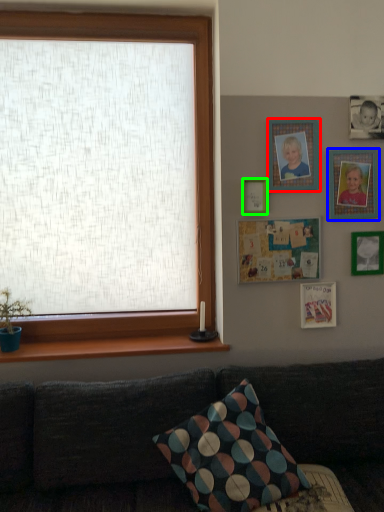
Question: Based on their relative distances, which object is farther from picture frame (highlighted by a red box)? Choose from picture frame (highlighted by a blue box) and picture frame (highlighted by a green box).

Choices:
 (A) picture frame
 (B) picture frame

Answer: (A)